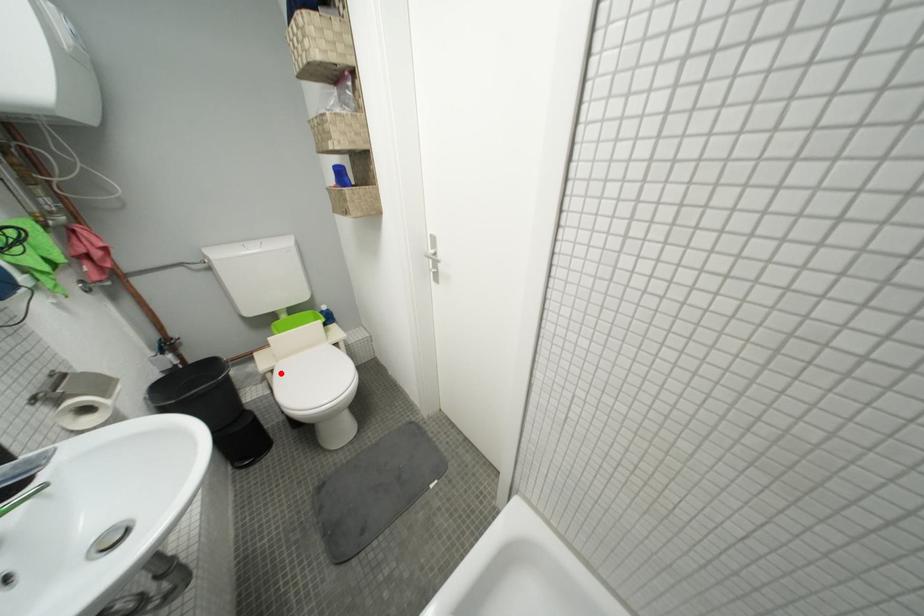
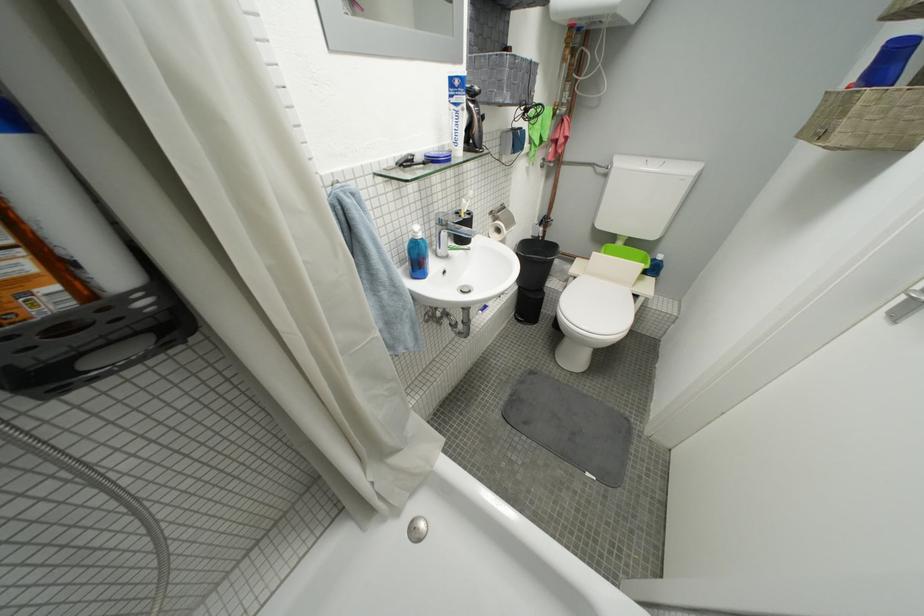
Question: A red point is marked in image1. In image2, is the corresponding 3D point closer to the camera or farther? Reply with the corresponding letter.

Choices:
 (A) The corresponding 3D point is closer.
 (B) The corresponding 3D point is farther.

Answer: (A)